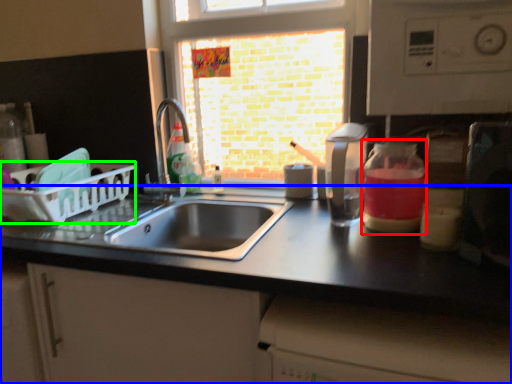
Question: Which is nearer to the glass jar (highlighted by a red box)? countertop (highlighted by a blue box) or basket (highlighted by a green box).

Choices:
 (A) countertop
 (B) basket

Answer: (A)